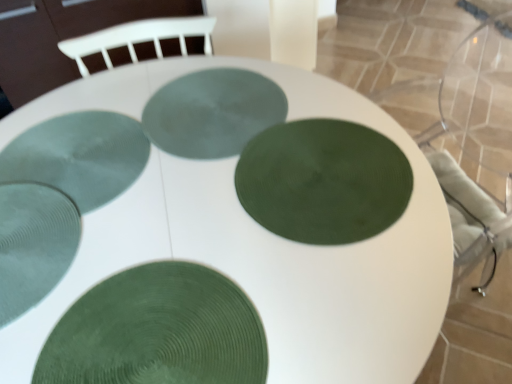
Where is `vacant space underneath green textured plate at center, which appears as the first glass plate when viewed from the front (from a real-world perspective)`? vacant space underneath green textured plate at center, which appears as the first glass plate when viewed from the front (from a real-world perspective) is located at coordinates click(x=155, y=337).